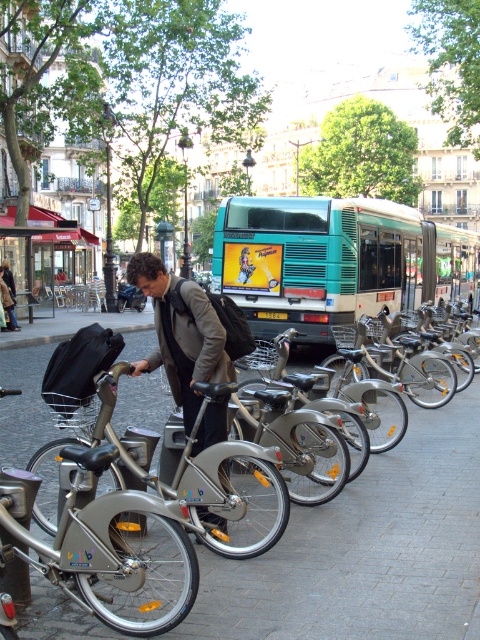
Is teal matte bus at center positioned behind matte gray jacket at center?

Yes, it is behind matte gray jacket at center.

At what (x,y) coordinates should I click in order to perform the action: click on teal matte bus at center. Please return your answer as a coordinate pair (x, y). The width and height of the screenshot is (480, 640). Looking at the image, I should click on (334, 260).

Is silver metallic pavement at center to the right of silver metallic bicycle at center from the viewer's perspective?

Indeed, silver metallic pavement at center is positioned on the right side of silver metallic bicycle at center.

Does point (335, 556) lie in front of point (245, 488)?

Yes, point (335, 556) is in front of point (245, 488).

Which is in front, point (414, 476) or point (216, 548)?

Positioned in front is point (216, 548).

Where is `silver metallic pavement at center`? Image resolution: width=480 pixels, height=640 pixels. silver metallic pavement at center is located at coordinates pos(365,550).

Can you confirm if silver metallic pavement at center is shorter than dark brown leather jacket at center?

Yes, silver metallic pavement at center is shorter than dark brown leather jacket at center.

Does point (17, 458) lie behind point (3, 273)?

No, it is not.

Identify the location of silver metallic pavement at center. Image resolution: width=480 pixels, height=640 pixels. (365, 550).